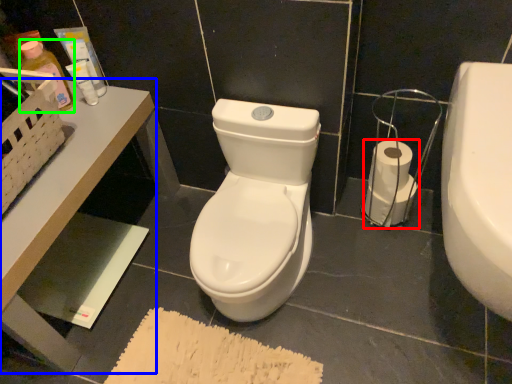
Question: Estimate the real-world distances between objects in this image. Which object is closer to toilet paper (highlighted by a red box), table (highlighted by a blue box) or toiletry (highlighted by a green box)?

Choices:
 (A) table
 (B) toiletry

Answer: (A)